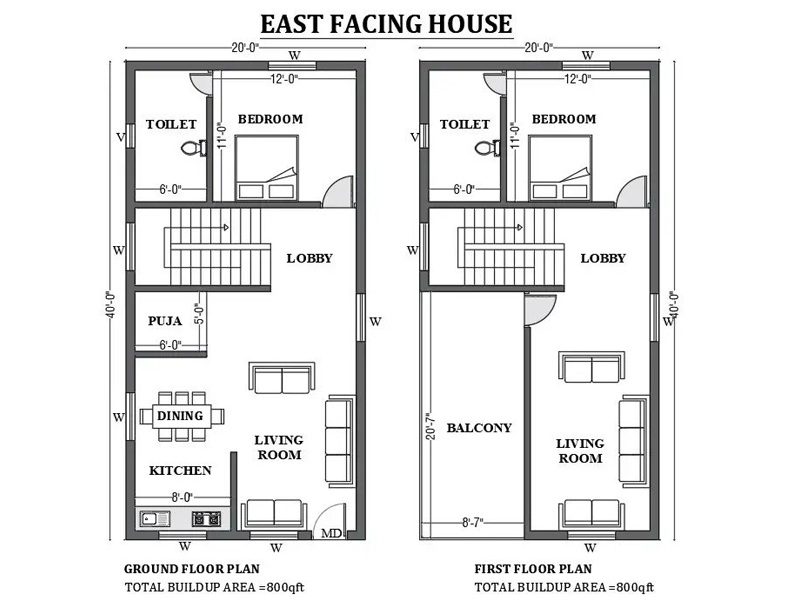
Locate an element on the screen. This screenshot has width=800, height=600. stairs is located at coordinates (197, 224), (221, 254), (490, 265), (489, 212).